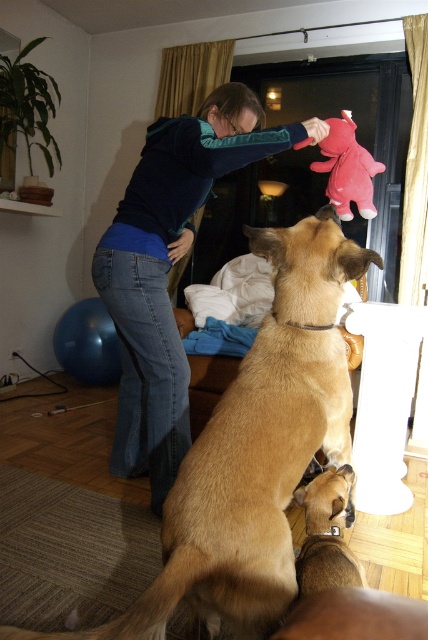
Question: Which object appears farthest from the camera in this image?

Choices:
 (A) brown fur dog at center
 (B) brown furry dog at center

Answer: (A)

Question: Among these points, which one is nearest to the camera?

Choices:
 (A) (152, 132)
 (B) (318, 300)
 (C) (350, 477)

Answer: (B)

Question: Which point is closer to the camera?

Choices:
 (A) blue fleece sweater at upper center
 (B) pink plush elephant at upper center
 (C) brown fur dog at center

Answer: (C)

Question: Does brown furry dog at center have a greater width compared to pink plush elephant at upper center?

Choices:
 (A) yes
 (B) no

Answer: (A)

Question: Is the position of brown furry dog at center less distant than that of brown fur dog at center?

Choices:
 (A) yes
 (B) no

Answer: (A)

Question: Can you confirm if brown furry dog at center is positioned to the right of blue fleece sweater at upper center?

Choices:
 (A) yes
 (B) no

Answer: (A)